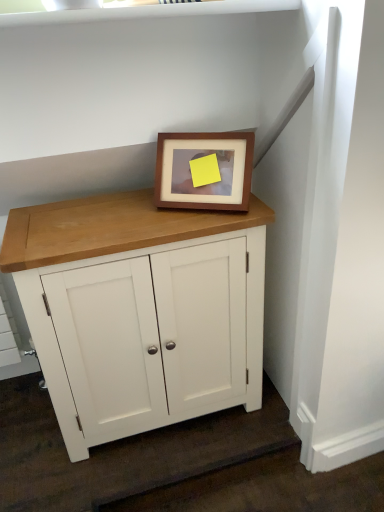
Question: Can you confirm if white painted wood cabinet at center is shorter than wooden picture frame at center?

Choices:
 (A) no
 (B) yes

Answer: (A)

Question: Considering the relative sizes of white painted wood cabinet at center and wooden picture frame at center in the image provided, is white painted wood cabinet at center taller than wooden picture frame at center?

Choices:
 (A) yes
 (B) no

Answer: (A)

Question: Can you confirm if white painted wood cabinet at center is positioned to the right of wooden picture frame at center?

Choices:
 (A) yes
 (B) no

Answer: (B)

Question: Does white painted wood cabinet at center contain wooden picture frame at center?

Choices:
 (A) yes
 (B) no

Answer: (B)

Question: Can you see white painted wood cabinet at center touching wooden picture frame at center?

Choices:
 (A) no
 (B) yes

Answer: (A)

Question: From the image's perspective, is white painted wood cabinet at center on top of wooden picture frame at center?

Choices:
 (A) yes
 (B) no

Answer: (B)

Question: Does wooden picture frame at center touch white painted wood cabinet at center?

Choices:
 (A) no
 (B) yes

Answer: (A)

Question: Is wooden picture frame at center to the left of white painted wood cabinet at center from the viewer's perspective?

Choices:
 (A) yes
 (B) no

Answer: (B)

Question: Is wooden picture frame at center located outside white painted wood cabinet at center?

Choices:
 (A) no
 (B) yes

Answer: (B)

Question: Is white painted wood cabinet at center inside wooden picture frame at center?

Choices:
 (A) no
 (B) yes

Answer: (A)

Question: Considering the relative sizes of wooden picture frame at center and white painted wood cabinet at center in the image provided, is wooden picture frame at center smaller than white painted wood cabinet at center?

Choices:
 (A) no
 (B) yes

Answer: (B)

Question: Is wooden picture frame at center oriented away from white painted wood cabinet at center?

Choices:
 (A) yes
 (B) no

Answer: (B)

Question: Considering the positions of white painted wood cabinet at center and wooden picture frame at center in the image, is white painted wood cabinet at center bigger or smaller than wooden picture frame at center?

Choices:
 (A) small
 (B) big

Answer: (B)